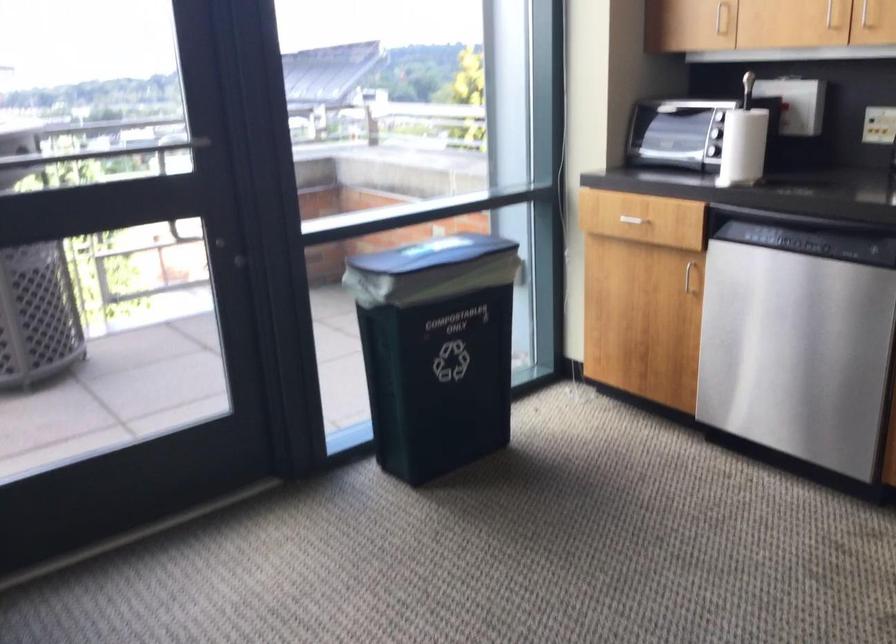
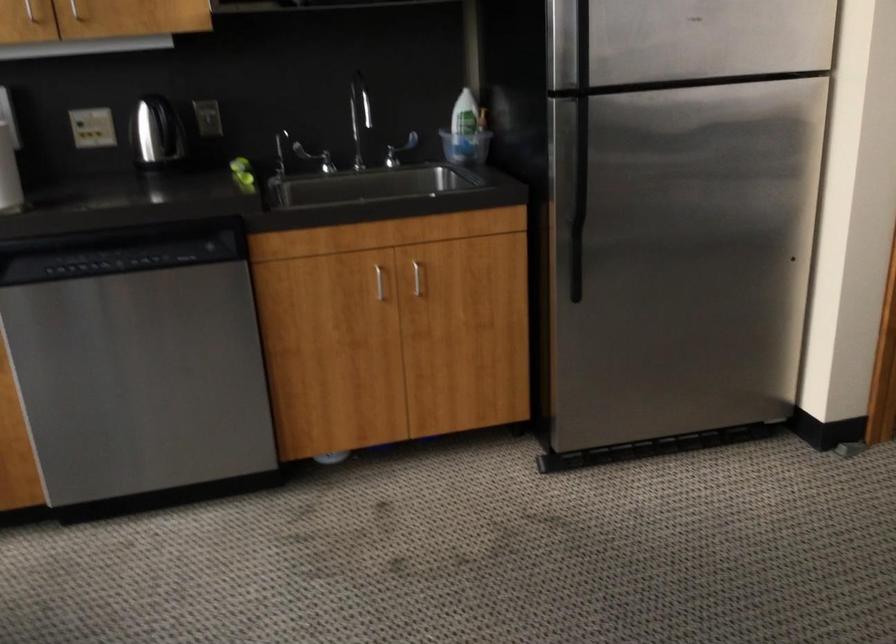
Question: The first image is from the beginning of the video and the second image is from the end. How did the camera likely rotate when shooting the video?

Choices:
 (A) Left
 (B) Right
 (C) Up
 (D) Down

Answer: (B)